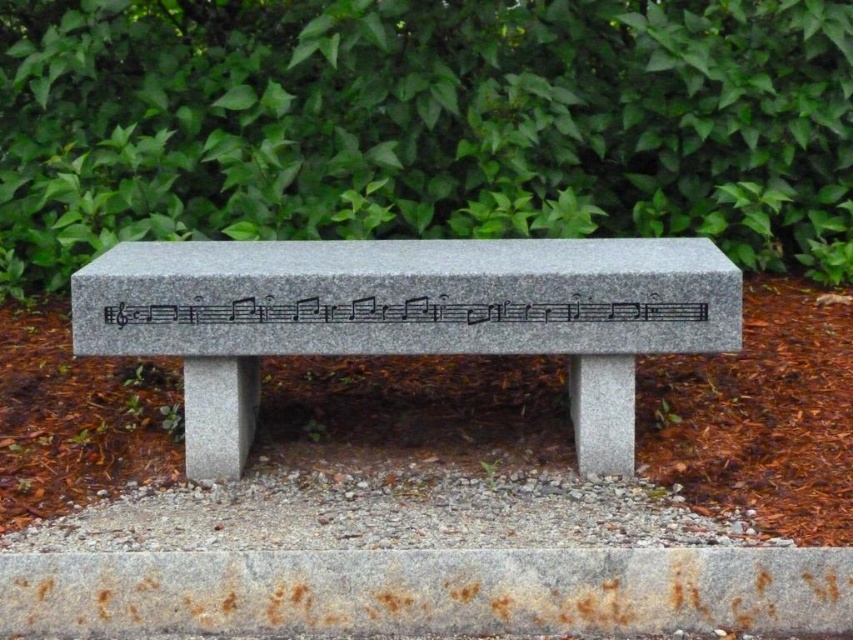
Question: Which object is closer to the camera taking this photo?

Choices:
 (A) granite bench at center
 (B) black granite musical notes at center
 (C) green leafy bush at upper center

Answer: (A)

Question: Where is green leafy bush at upper center located in relation to black granite musical notes at center in the image?

Choices:
 (A) below
 (B) above

Answer: (B)

Question: Which object appears farthest from the camera in this image?

Choices:
 (A) granite bench at center
 (B) black granite musical notes at center
 (C) green leafy bush at upper center

Answer: (C)

Question: From the image, what is the correct spatial relationship of green leafy bush at upper center in relation to black granite musical notes at center?

Choices:
 (A) right
 (B) left

Answer: (A)

Question: Does granite bench at center have a lesser width compared to black granite musical notes at center?

Choices:
 (A) yes
 (B) no

Answer: (B)

Question: Estimate the real-world distances between objects in this image. Which object is farther from the granite bench at center?

Choices:
 (A) green leafy bush at upper center
 (B) black granite musical notes at center

Answer: (A)